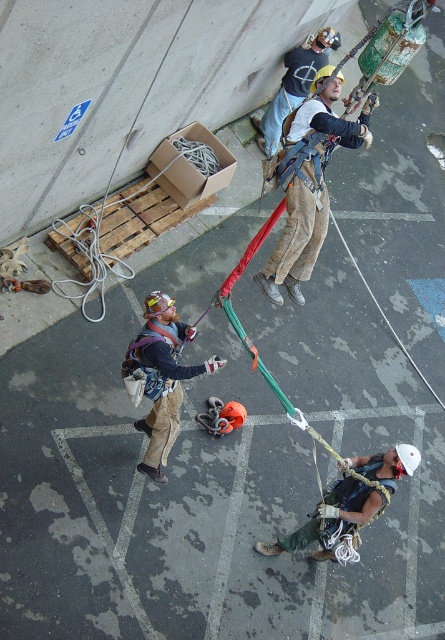
Question: Which object is farther from the camera taking this photo?

Choices:
 (A) matte black harness at center
 (B) rope-wrapped helmet at center
 (C) matte black harness at upper center

Answer: (C)

Question: Can you confirm if matte black harness at upper center is positioned above matte black harness at center?

Choices:
 (A) no
 (B) yes

Answer: (B)

Question: Which of the following is the closest to the observer?

Choices:
 (A) (350, 484)
 (B) (142, 458)
 (C) (267, 273)

Answer: (A)

Question: Is rope-wrapped helmet at center closer to the viewer compared to matte black harness at center?

Choices:
 (A) no
 (B) yes

Answer: (B)

Question: Which point is closer to the camera?

Choices:
 (A) matte black harness at center
 (B) rope-wrapped helmet at center

Answer: (B)

Question: Is matte black harness at upper center closer to camera compared to matte black harness at center?

Choices:
 (A) no
 (B) yes

Answer: (A)